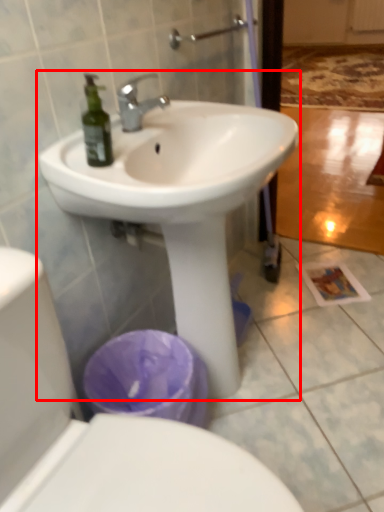
Question: From the image, what is the correct spatial relationship of sink (annotated by the red box) in relation to toilet?

Choices:
 (A) left
 (B) right

Answer: (B)